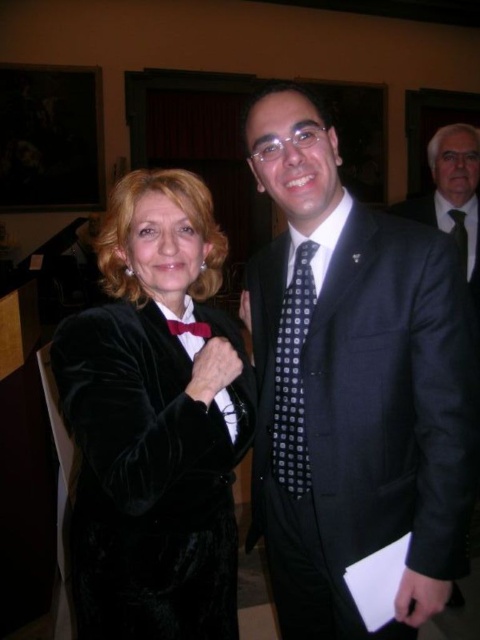
Question: Can you confirm if velvet black dress at center is positioned below black silk suit at center?

Choices:
 (A) no
 (B) yes

Answer: (B)

Question: Does black textured suit at center have a larger size compared to black silk suit at center?

Choices:
 (A) yes
 (B) no

Answer: (A)

Question: Estimate the real-world distances between objects in this image. Which object is closer to the dark blue dotted tie at center?

Choices:
 (A) velvet black dress at center
 (B) black dotted tie at center
 (C) black silk suit at center
 (D) black textured suit at center

Answer: (C)

Question: Which point is farther from the camera taking this photo?

Choices:
 (A) (454, 212)
 (B) (175, 321)

Answer: (A)

Question: Does velvet black dress at center have a greater width compared to black dotted tie at center?

Choices:
 (A) no
 (B) yes

Answer: (B)

Question: Among these objects, which one is farthest from the camera?

Choices:
 (A) dark blue dotted tie at center
 (B) red satin bow tie at center

Answer: (A)